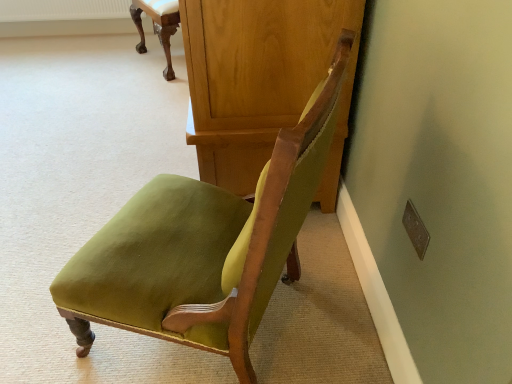
Question: From a real-world perspective, is wooden dresser at center positioned above or below velvet green chair at center, positioned as the second chair in back-to-front order?

Choices:
 (A) below
 (B) above

Answer: (A)

Question: In the image, is wooden dresser at center positioned in front of or behind velvet green chair at center, positioned as the second chair in back-to-front order?

Choices:
 (A) front
 (B) behind

Answer: (B)

Question: Which object is the farthest from the matte green fabric chair at upper center, which ranks as the 1th chair in back-to-front order?

Choices:
 (A) velvet green chair at center, the 1th chair when ordered from bottom to top
 (B) wooden dresser at center

Answer: (A)

Question: Which object is positioned closest to the matte green fabric chair at upper center, which ranks as the 1th chair in back-to-front order?

Choices:
 (A) velvet green chair at center, the first chair from the front
 (B) wooden dresser at center

Answer: (B)